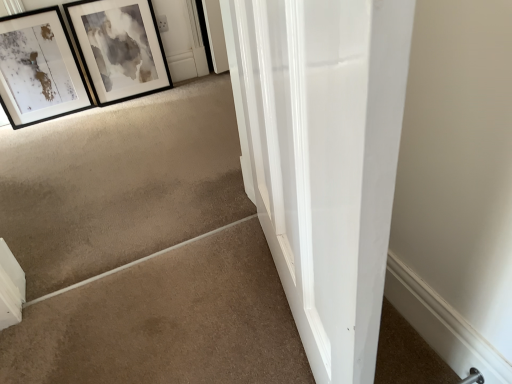
Question: From a real-world perspective, does beige carpet at lower left sit lower than black matte picture frame at upper left, which is counted as the first picture frame, starting from the right?

Choices:
 (A) yes
 (B) no

Answer: (A)

Question: Considering the relative sizes of beige carpet at lower left and black matte picture frame at upper left, marked as the second picture frame in a left-to-right arrangement, in the image provided, is beige carpet at lower left shorter than black matte picture frame at upper left, marked as the second picture frame in a left-to-right arrangement,?

Choices:
 (A) yes
 (B) no

Answer: (A)

Question: Could you tell me if beige carpet at lower left is facing black matte picture frame at upper left, which is counted as the first picture frame, starting from the right?

Choices:
 (A) no
 (B) yes

Answer: (B)

Question: Is beige carpet at lower left in contact with black matte picture frame at upper left, which is counted as the first picture frame, starting from the right?

Choices:
 (A) yes
 (B) no

Answer: (B)

Question: Would you say beige carpet at lower left contains black matte picture frame at upper left, marked as the second picture frame in a left-to-right arrangement?

Choices:
 (A) yes
 (B) no

Answer: (B)

Question: Can you confirm if beige carpet at lower left is taller than black matte picture frame at upper left, which is counted as the first picture frame, starting from the right?

Choices:
 (A) no
 (B) yes

Answer: (A)

Question: Is matte black picture frame at upper left, which is the first picture frame from left to right, taller than beige carpet at lower left?

Choices:
 (A) no
 (B) yes

Answer: (B)

Question: Is matte black picture frame at upper left, which is the first picture frame from left to right, facing towards beige carpet at lower left?

Choices:
 (A) no
 (B) yes

Answer: (B)

Question: From the image's perspective, is matte black picture frame at upper left, which is the 2th picture frame in right-to-left order, on top of beige carpet at lower left?

Choices:
 (A) yes
 (B) no

Answer: (A)

Question: Is the position of matte black picture frame at upper left, which is the first picture frame from left to right, less distant than that of beige carpet at lower left?

Choices:
 (A) yes
 (B) no

Answer: (B)

Question: From a real-world perspective, is matte black picture frame at upper left, which is the first picture frame from left to right, located beneath beige carpet at lower left?

Choices:
 (A) yes
 (B) no

Answer: (B)

Question: Is matte black picture frame at upper left, which is the 2th picture frame in right-to-left order, at the right side of beige carpet at lower left?

Choices:
 (A) no
 (B) yes

Answer: (A)

Question: From the image's perspective, is beige carpet at lower left beneath matte black picture frame at upper left, which is the first picture frame from left to right?

Choices:
 (A) yes
 (B) no

Answer: (A)